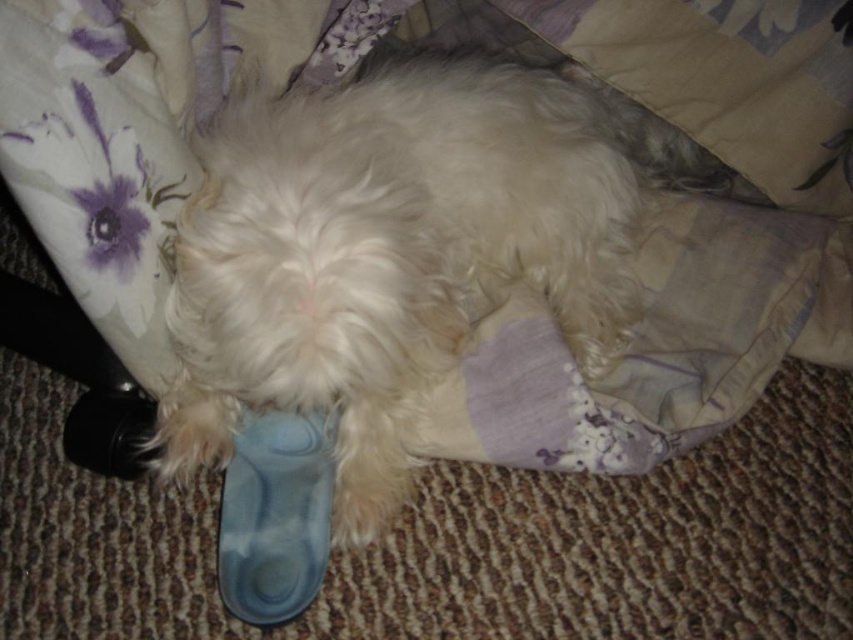
Question: Which of the following is the closest to the observer?

Choices:
 (A) (540, 244)
 (B) (221, 513)

Answer: (B)

Question: In this image, where is white fluffy dog at center located relative to blue rubber shoe at lower center?

Choices:
 (A) below
 (B) above

Answer: (B)

Question: Does white fluffy dog at center appear over blue rubber shoe at lower center?

Choices:
 (A) yes
 (B) no

Answer: (A)

Question: Which object is closer to the camera taking this photo?

Choices:
 (A) blue rubber shoe at lower center
 (B) white fluffy dog at center

Answer: (B)

Question: Which point is farther to the camera?

Choices:
 (A) white fluffy dog at center
 (B) blue rubber shoe at lower center

Answer: (B)

Question: Does white fluffy dog at center have a larger size compared to blue rubber shoe at lower center?

Choices:
 (A) no
 (B) yes

Answer: (B)